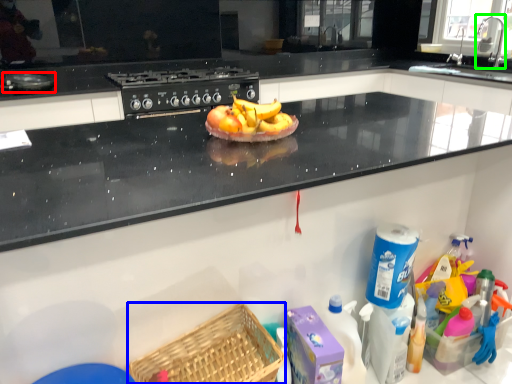
Question: Estimate the real-world distances between objects in this image. Which object is farther from appliance (highlighted by a red box), basket (highlighted by a blue box) or faucet (highlighted by a green box)?

Choices:
 (A) basket
 (B) faucet

Answer: (B)